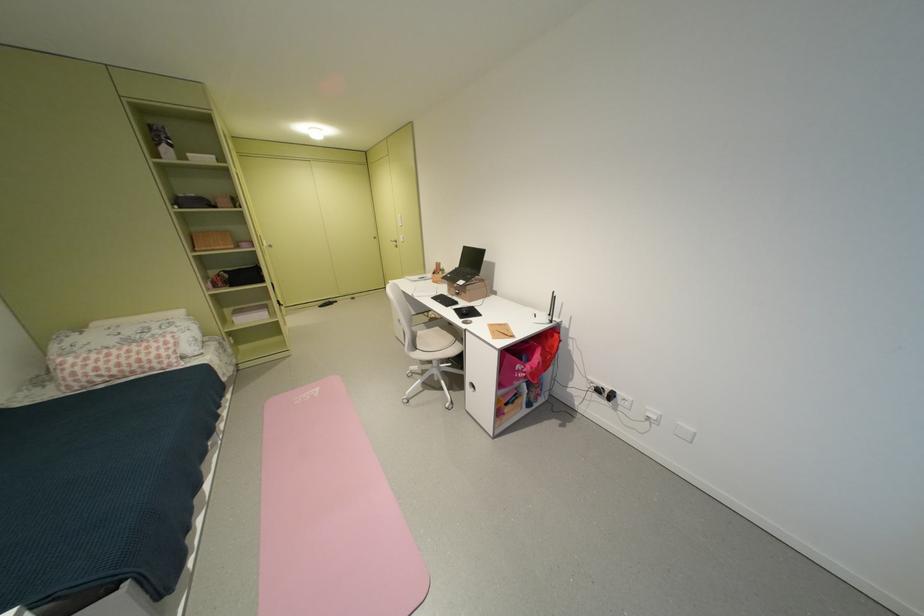
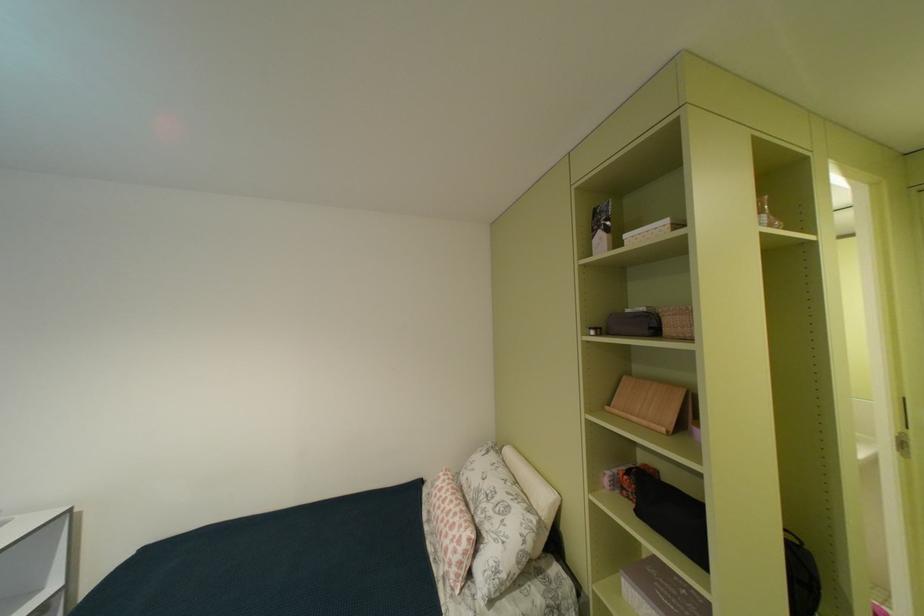
Locate, in the second image, the point that corresponds to the point at 174,355 in the first image.

(458, 556)